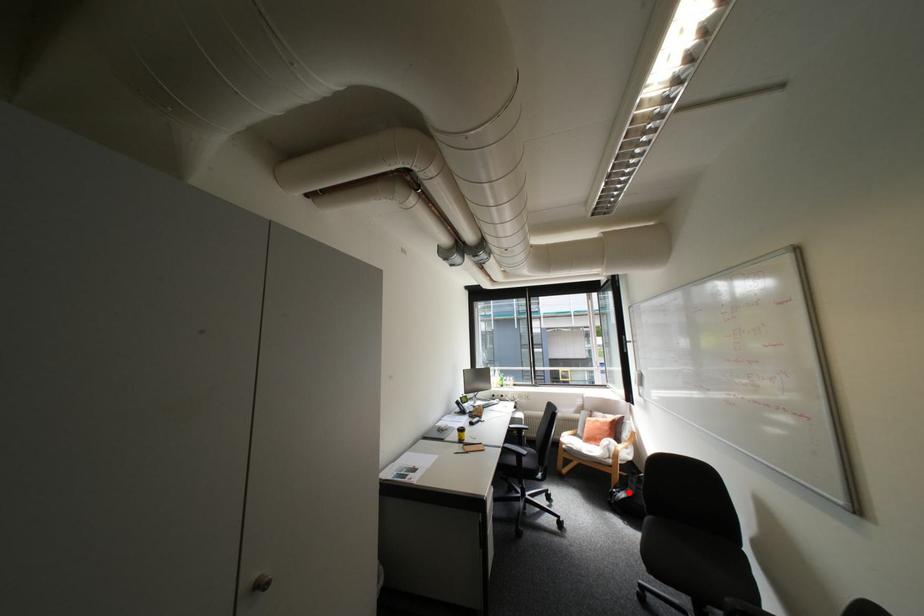
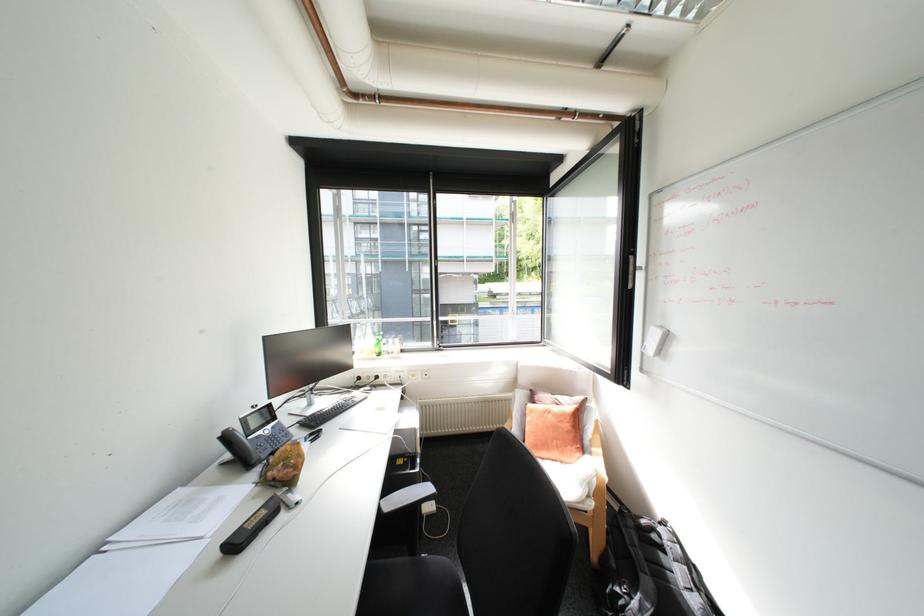
Question: I am providing you with two images of the same scene from different viewpoints. Image1 has a red point marked. In image2, the corresponding 3D location appears at what relative position? Reply with the corresponding letter.

Choices:
 (A) Closer
 (B) Farther

Answer: (A)